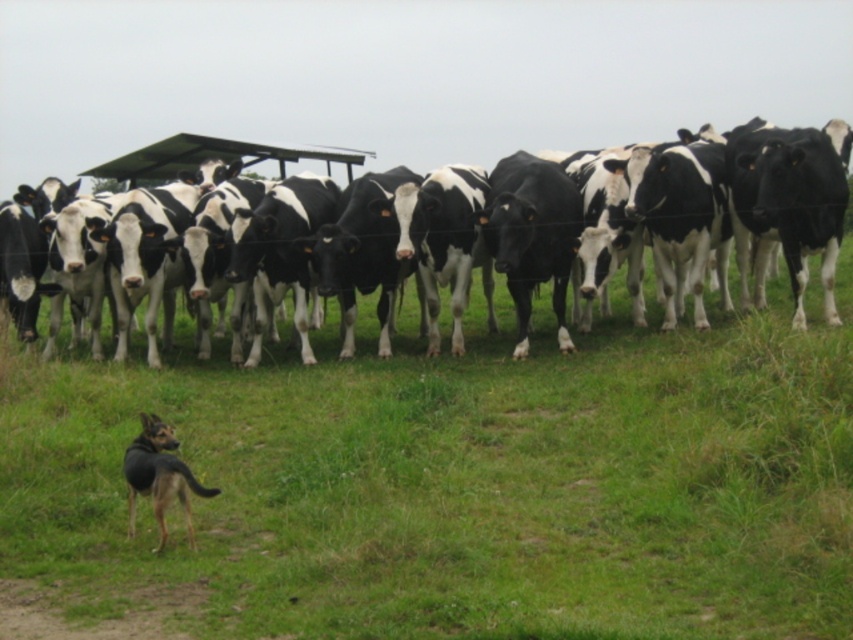
Who is taller, green grass at lower center or brown fur dog at lower left?

With more height is brown fur dog at lower left.

Describe the element at coordinates (457, 484) in the screenshot. I see `green grass at lower center` at that location.

Is point (712, 561) closer to camera compared to point (154, 486)?

That is True.

Image resolution: width=853 pixels, height=640 pixels. I want to click on green grass at lower center, so [457, 484].

Does black and white cows at center have a greater height compared to brown fur dog at lower left?

Correct, black and white cows at center is much taller as brown fur dog at lower left.

Which is in front, point (28, 332) or point (135, 444)?

Positioned in front is point (135, 444).

Is point (143, 161) closer to viewer compared to point (160, 448)?

That is False.

Identify the location of black and white cows at center. (209, 161).

Measure the distance from green grass at lower center to black and white cows at center.

39.81 feet

Can you confirm if green grass at lower center is positioned above black and white cows at center?

Incorrect, green grass at lower center is not positioned above black and white cows at center.

Identify the location of green grass at lower center. (457, 484).